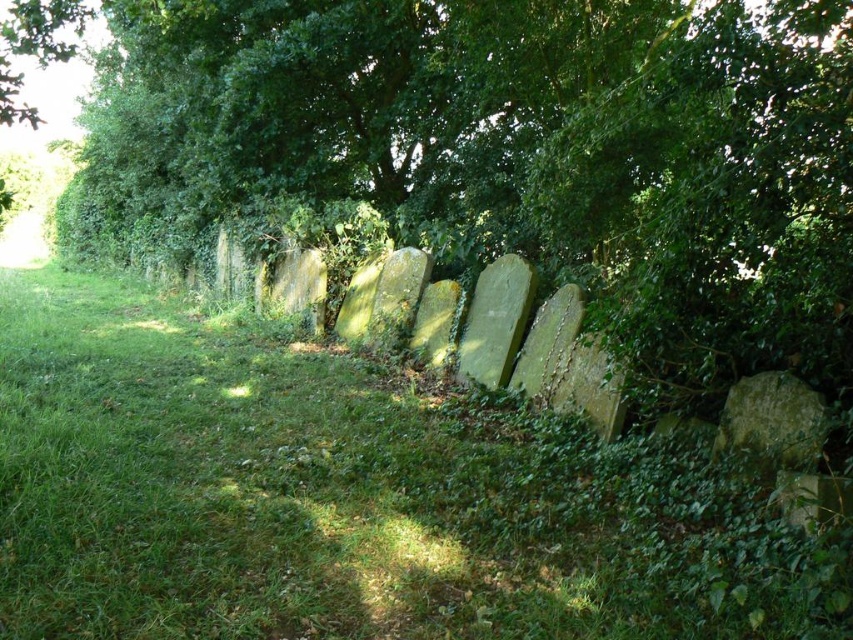
Looking at this image, does green grassy at center have a greater width compared to green leafy tree at center?

In fact, green grassy at center might be narrower than green leafy tree at center.

Can you confirm if green grassy at center is shorter than green leafy tree at center?

Yes, green grassy at center is shorter than green leafy tree at center.

What do you see at coordinates (347, 499) in the screenshot? The height and width of the screenshot is (640, 853). I see `green grassy at center` at bounding box center [347, 499].

I want to click on green grassy at center, so click(347, 499).